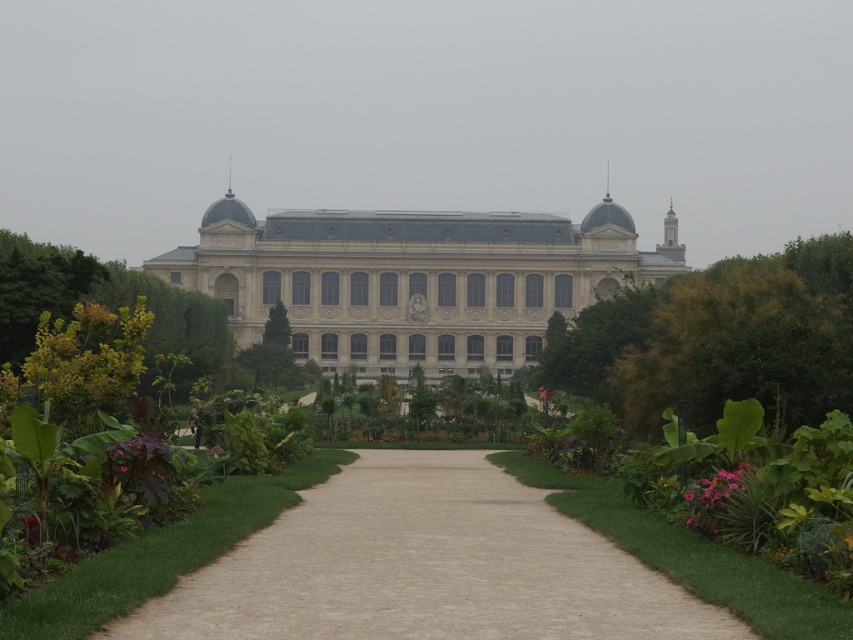
Question: Can you confirm if beige stone building at center is thinner than green leafy tree at left?

Choices:
 (A) yes
 (B) no

Answer: (B)

Question: Estimate the real-world distances between objects in this image. Which object is farther from the pink matte flowers at lower right?

Choices:
 (A) green leafy plant at center
 (B) brown gravel path at center
 (C) green leafy tree at left
 (D) beige stone building at center

Answer: (D)

Question: Where is beige stone building at center located in relation to pink matte flowers at lower right in the image?

Choices:
 (A) above
 (B) below

Answer: (A)

Question: Which of the following is the farthest from the observer?

Choices:
 (A) (547, 397)
 (B) (784, 356)
 (C) (322, 320)

Answer: (C)

Question: Where is green leafy tree at center located in relation to green leafy plant at center in the image?

Choices:
 (A) above
 (B) below

Answer: (A)

Question: Which of the following is the closest to the observer?

Choices:
 (A) (538, 396)
 (B) (20, 305)
 (C) (514, 547)

Answer: (C)